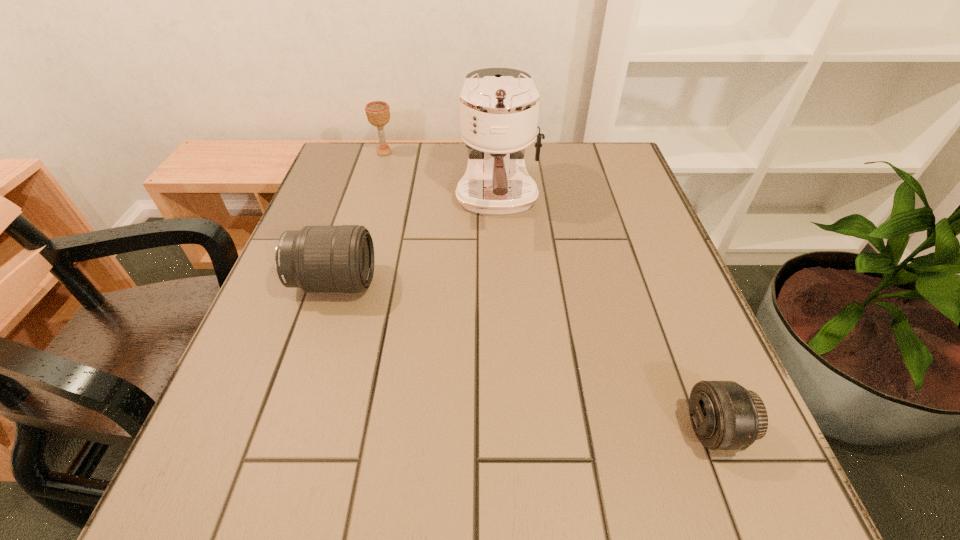
Locate an element on the screen. Image resolution: width=960 pixels, height=540 pixels. free space at the near edge of the desktop is located at coordinates (438, 465).

In the image, there is a desktop. At what (x,y) coordinates should I click in order to perform the action: click on free space at the left edge. Please return your answer as a coordinate pair (x, y). The image size is (960, 540). Looking at the image, I should click on (347, 192).

I want to click on vacant space at the right edge of the desktop, so click(615, 259).

Find the location of a particular element. unoccupied area between the second object from right to left and the left telephoto lens is located at coordinates (416, 241).

Find the location of `vacant point located between the third nearest object and the shortest object`. vacant point located between the third nearest object and the shortest object is located at coordinates (606, 315).

You are a GUI agent. You are given a task and a screenshot of the screen. Output one action in this format:
    pyautogui.click(x=<x>, y=<y>)
    Task: Click on the vacant area that lies between the shortest object and the second farthest object
    The image size is (960, 540).
    Given the screenshot: What is the action you would take?
    pyautogui.click(x=606, y=315)

The image size is (960, 540). I want to click on free space between the third nearest object and the left telephoto lens, so click(x=416, y=241).

Locate an element on the screen. The image size is (960, 540). free space between the second nearest object and the farthest object is located at coordinates (359, 218).

Find the location of a particular element. vacant area that lies between the second nearest object and the shortest object is located at coordinates (524, 356).

Identify the location of free area in between the third farthest object and the coffee maker. The width and height of the screenshot is (960, 540). (416, 241).